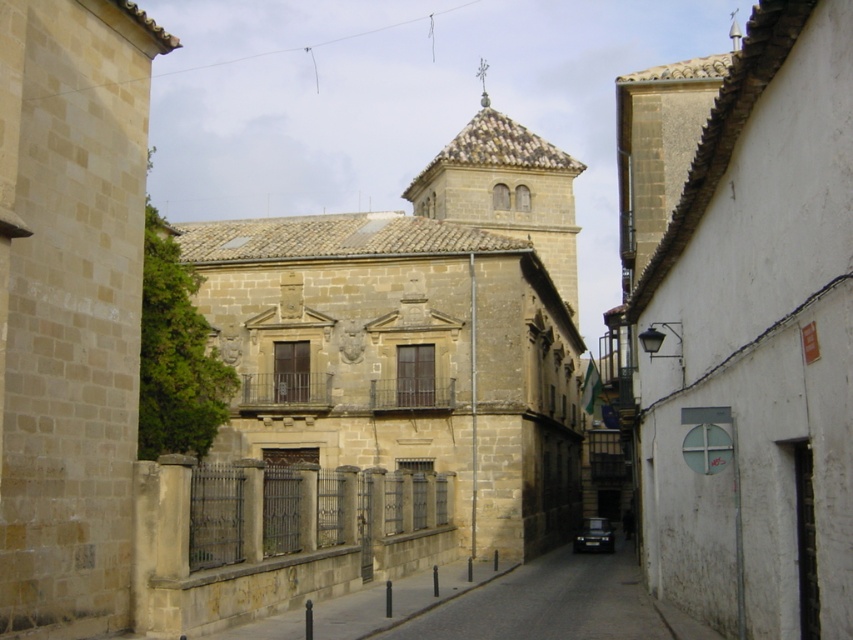
Question: Which of the following is the closest to the observer?

Choices:
 (A) white stucco church at center
 (B) brown stone tower at center
 (C) stone church at center
 (D) dark gray asphalt at center

Answer: (A)

Question: Can you confirm if white stucco church at center is thinner than brown stone tower at center?

Choices:
 (A) yes
 (B) no

Answer: (A)

Question: Which point is farther from the camera taking this photo?

Choices:
 (A) (698, 589)
 (B) (601, 547)
 (C) (413, 560)

Answer: (B)

Question: Among these points, which one is nearest to the camera?

Choices:
 (A) click(418, 616)
 (B) click(402, 452)

Answer: (A)

Question: Can you confirm if brown stone tower at center is bigger than black glossy car at center?

Choices:
 (A) yes
 (B) no

Answer: (A)

Question: Is stone church at center to the right of dark gray asphalt at center from the viewer's perspective?

Choices:
 (A) no
 (B) yes

Answer: (A)